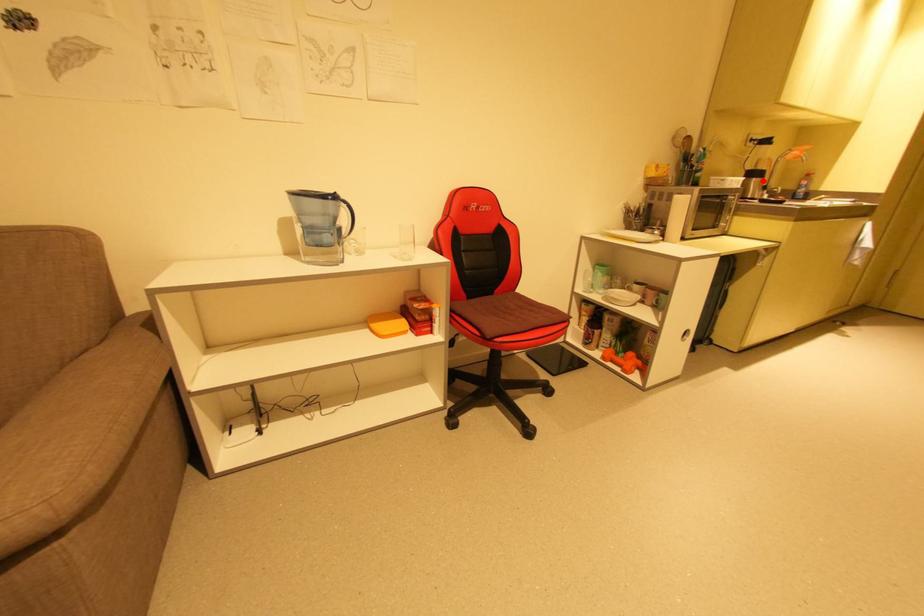
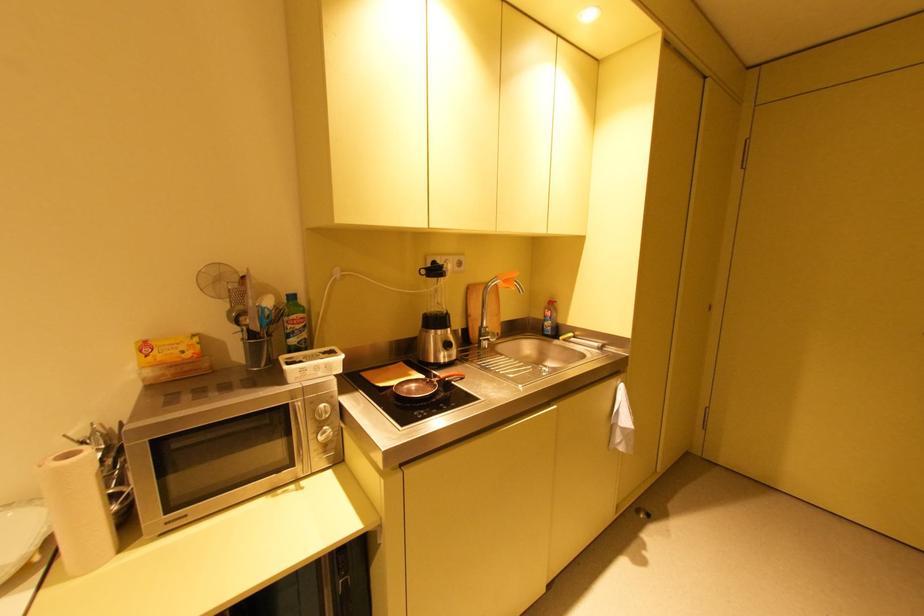
In the second image, find the point that corresponds to the highlighted location in the first image.

(444, 331)